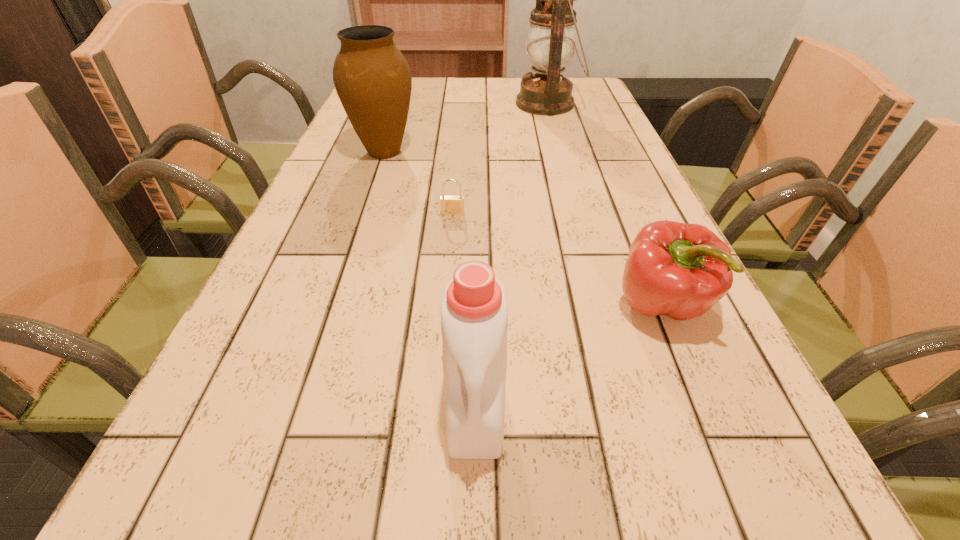
I want to click on free spot between the leftmost object and the lantern, so [467, 127].

Locate an element on the screen. vacant region between the detergent and the farthest object is located at coordinates (512, 255).

Image resolution: width=960 pixels, height=540 pixels. In order to click on the third closest object to the second farthest object in this screenshot , I will do `click(679, 270)`.

At what (x,y) coordinates should I click in order to perform the action: click on object that is the fourth closest to the third farthest object. Please return your answer as a coordinate pair (x, y). The height and width of the screenshot is (540, 960). Looking at the image, I should click on (551, 35).

Where is `vacant space that satisfies the following two spatial constraints: 1. on the front-facing side of the fourth farthest object; 2. on the right side of the third farthest object`? This screenshot has height=540, width=960. vacant space that satisfies the following two spatial constraints: 1. on the front-facing side of the fourth farthest object; 2. on the right side of the third farthest object is located at coordinates (446, 305).